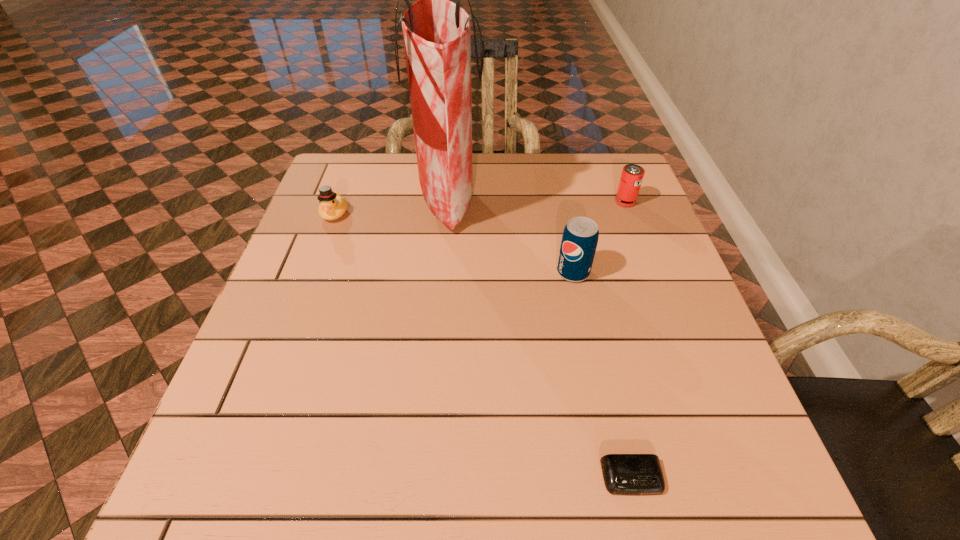
Locate which object is the third closest to the pop. Please provide its 2D coordinates. Your answer should be formatted as a tuple, i.e. [(x, y)], where the tuple contains the x and y coordinates of a point satisfying the conditions above.

[(624, 474)]

This screenshot has height=540, width=960. Identify the location of object identified as the closest to the can. (579, 241).

You are a GUI agent. You are given a task and a screenshot of the screen. Output one action in this format:
    pyautogui.click(x=<x>, y=<y>)
    Task: Click on the free spot that satisfies the following two spatial constraints: 1. on the front side of the can; 2. on the left side of the fourth object from right to left
    This screenshot has width=960, height=540.
    Given the screenshot: What is the action you would take?
    pyautogui.click(x=447, y=201)